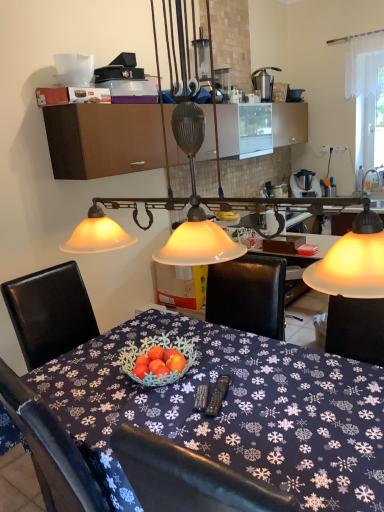
Question: Visually, is metallic silver juicer at upper right positioned to the left or to the right of blue fabric tablecloth at center?

Choices:
 (A) left
 (B) right

Answer: (B)

Question: Considering the positions of metallic silver juicer at upper right and blue fabric tablecloth at center in the image, is metallic silver juicer at upper right taller or shorter than blue fabric tablecloth at center?

Choices:
 (A) tall
 (B) short

Answer: (B)

Question: Which of these objects is positioned farthest from the metallic silver blender at right?

Choices:
 (A) white sheer curtain at upper right
 (B) metallic silver juicer at upper right
 (C) brown matte cabinet at upper center
 (D) blue fabric tablecloth at center
 (E) brushed metal faucet at upper right

Answer: (D)

Question: Which object is positioned closest to the brown matte cabinet at upper center?

Choices:
 (A) metallic silver blender at right
 (B) white sheer curtain at upper right
 (C) blue fabric tablecloth at center
 (D) metallic silver juicer at upper right
 (E) brushed metal faucet at upper right

Answer: (C)